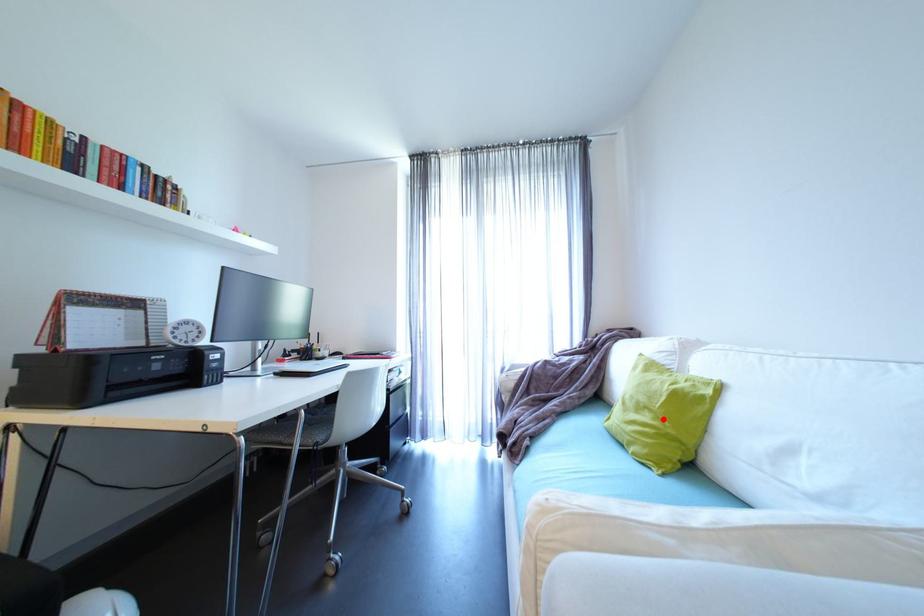
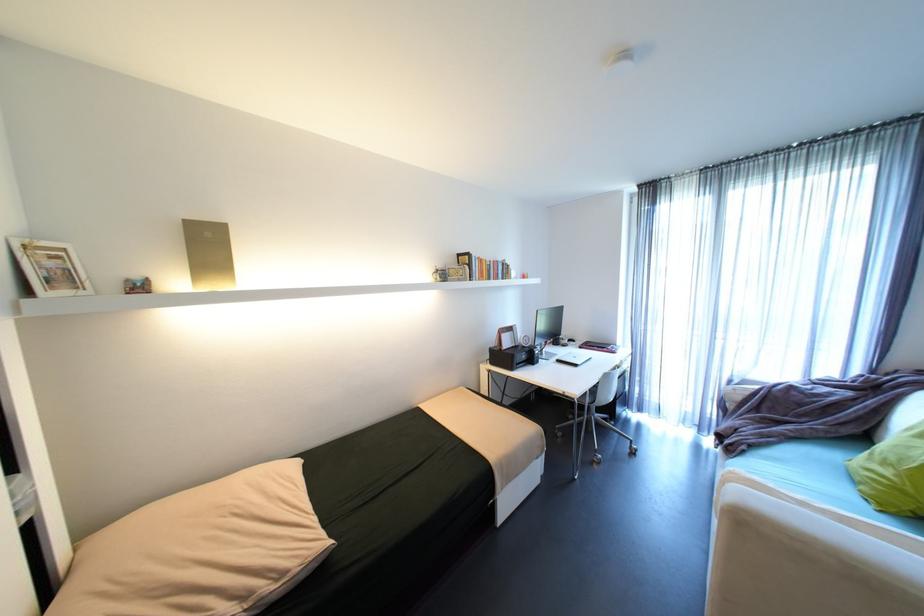
Question: I am providing you with two images of the same scene from different viewpoints. Image1 has a red point marked. In image2, the corresponding 3D location appears at what relative position? Reply with the corresponding letter.

Choices:
 (A) Closer
 (B) Farther

Answer: (B)